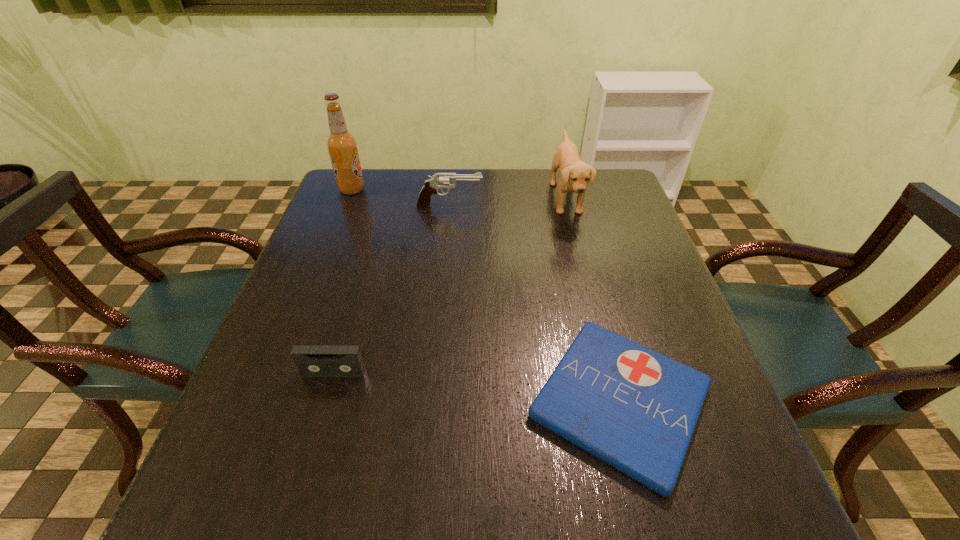
The width and height of the screenshot is (960, 540). I want to click on vacant space at the far left corner of the desktop, so click(379, 210).

The image size is (960, 540). I want to click on empty space between the videotape and the puppy, so click(x=449, y=286).

Locate an element on the screen. free space between the first-aid kit and the puppy is located at coordinates (593, 300).

Identify the location of vacant point located between the puppy and the third object from left to right. (508, 202).

Find the location of a particular element. The image size is (960, 540). empty location between the fourth object from right to left and the gun is located at coordinates (392, 289).

Where is `blank region between the third object from left to right and the leftmost object`? The height and width of the screenshot is (540, 960). blank region between the third object from left to right and the leftmost object is located at coordinates (400, 198).

I want to click on free space between the puppy and the first-aid kit, so click(593, 300).

Where is `vacant space that is in between the third object from right to left and the videotape`? This screenshot has width=960, height=540. vacant space that is in between the third object from right to left and the videotape is located at coordinates (392, 289).

Find the location of a particular element. The width and height of the screenshot is (960, 540). vacant area that lies between the gun and the second tallest object is located at coordinates (508, 202).

Where is `vacant area that lies between the shortest object and the tallest object`? vacant area that lies between the shortest object and the tallest object is located at coordinates (486, 295).